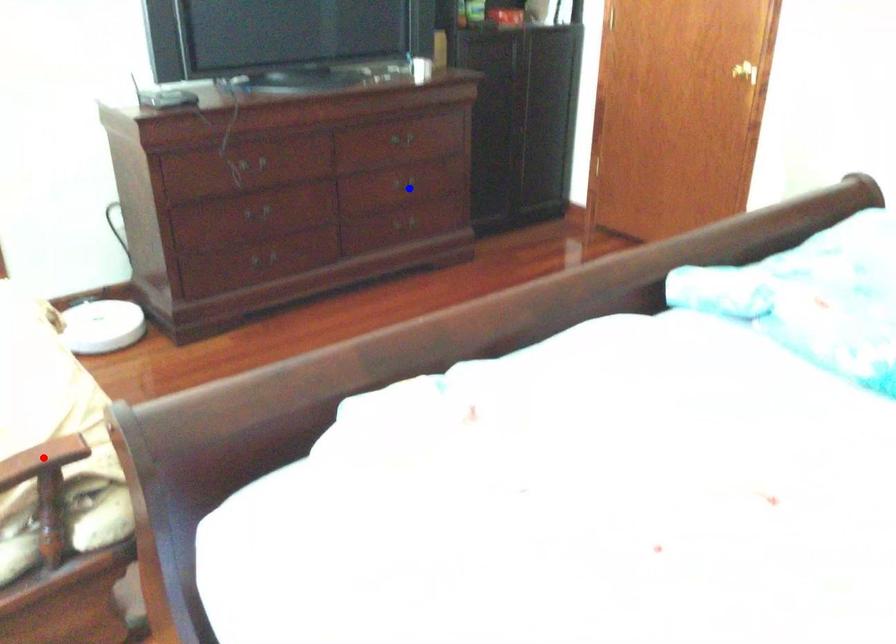
Question: Which of the two points in the image is closer to the camera?

Choices:
 (A) Blue point is closer.
 (B) Red point is closer.

Answer: (B)